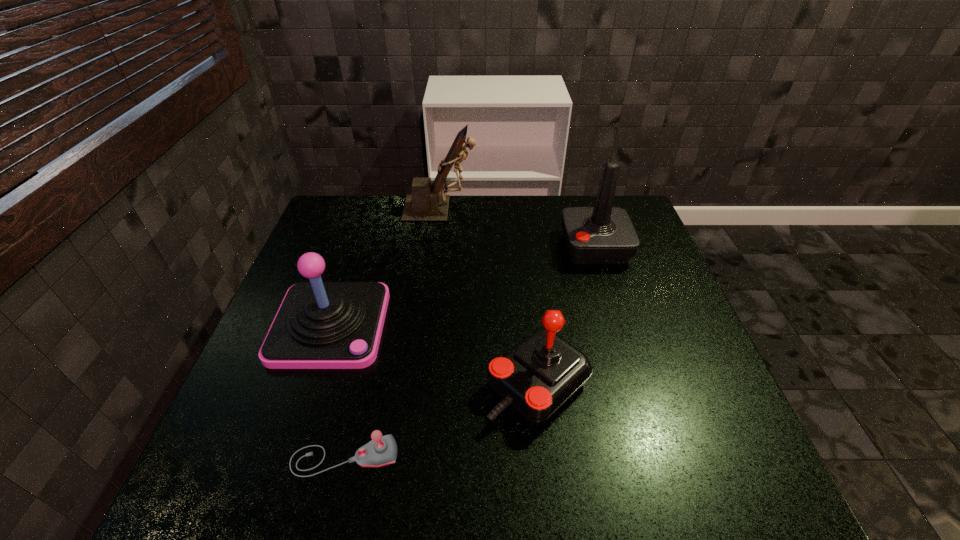
Identify the location of joystick that stands as the closest to the nearest object. The height and width of the screenshot is (540, 960). (319, 325).

This screenshot has width=960, height=540. Identify the location of vacant space that satisfies the following two spatial constraints: 1. on the back side of the second object from right to left; 2. on the front-facing side of the farthest object. (518, 209).

At what (x,y) coordinates should I click in order to perform the action: click on free location that satisfies the following two spatial constraints: 1. on the front-facing side of the figurine; 2. on the front side of the nearest object. Please return your answer as a coordinate pair (x, y). The image size is (960, 540). Looking at the image, I should click on (411, 457).

The image size is (960, 540). I want to click on vacant space that satisfies the following two spatial constraints: 1. on the back side of the fourth object from left to right; 2. on the left side of the nearest joystick, so click(x=362, y=384).